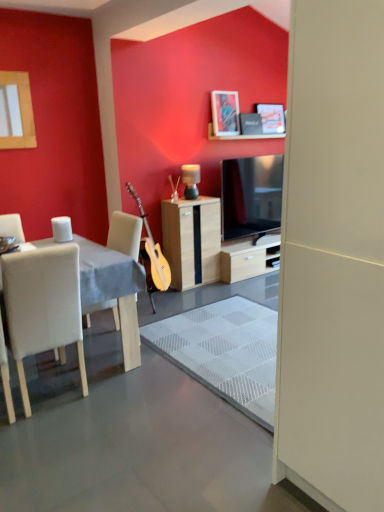
Question: Considering the positions of white glossy coffee cup at left and wooden cabinet at center in the image, is white glossy coffee cup at left wider or thinner than wooden cabinet at center?

Choices:
 (A) thin
 (B) wide

Answer: (A)

Question: Considering the positions of point (56, 234) and point (216, 243), is point (56, 234) closer or farther from the camera than point (216, 243)?

Choices:
 (A) farther
 (B) closer

Answer: (B)

Question: Considering the real-world distances, which object is closest to the matte black picture frame at upper center, the 2th picture frame viewed from the front?

Choices:
 (A) white matte screen door at center
 (B) wooden cabinet at center
 (C) white fabric table at left
 (D) white glossy coffee cup at left
 (E) matte black lamp at center

Answer: (E)

Question: Which object is the farthest from the matte black lamp at center?

Choices:
 (A) wooden cabinet at center
 (B) white glossy coffee cup at left
 (C) white matte screen door at center
 (D) white leather chair at left
 (E) white fabric table at left

Answer: (C)